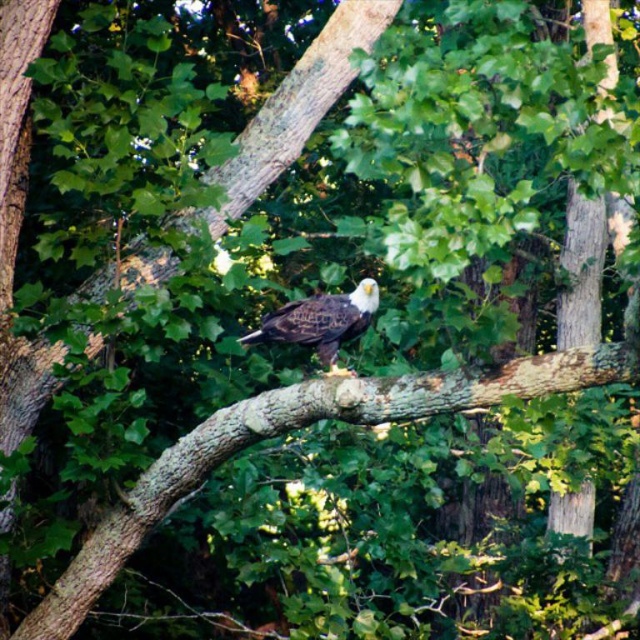
Question: Among these objects, which one is farthest from the camera?

Choices:
 (A) white-feathered eagle at center
 (B) brown rough tree branch at center

Answer: (A)

Question: Observing the image, what is the correct spatial positioning of brown rough tree branch at center in reference to white-feathered eagle at center?

Choices:
 (A) above
 (B) below

Answer: (B)

Question: Does brown rough tree branch at center have a smaller size compared to white-feathered eagle at center?

Choices:
 (A) yes
 (B) no

Answer: (B)

Question: Is brown rough tree branch at center further to the viewer compared to white-feathered eagle at center?

Choices:
 (A) yes
 (B) no

Answer: (B)